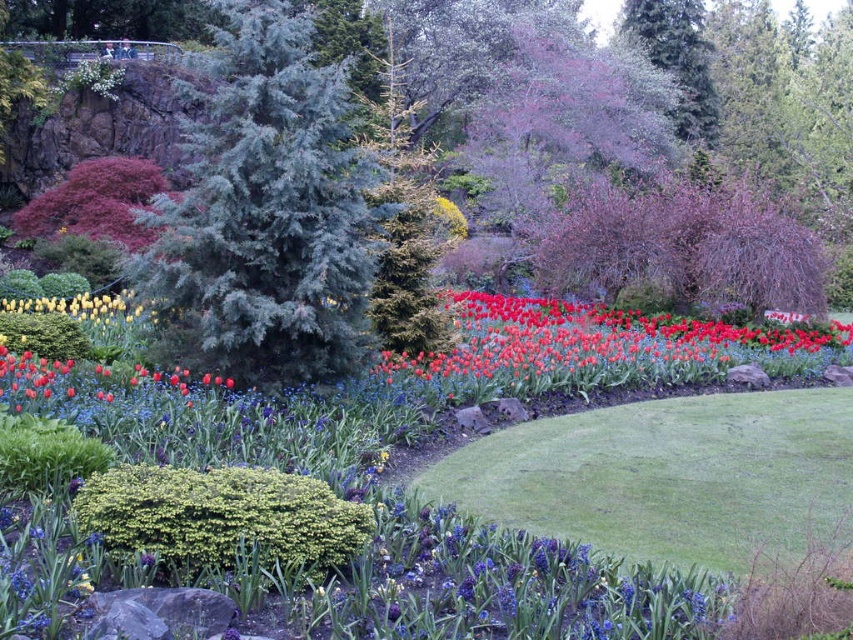
Can you confirm if green textured pine tree at center is wider than yellow matte tulip at left?

Correct, the width of green textured pine tree at center exceeds that of yellow matte tulip at left.

Which is behind, point (381, 321) or point (51, 305)?

The point (51, 305) is behind.

Locate an element on the screen. The width and height of the screenshot is (853, 640). green textured pine tree at center is located at coordinates (405, 216).

Is the position of green textured bush at lower center less distant than that of green textured pine tree at center?

Yes, it is in front of green textured pine tree at center.

Is green textured bush at lower center above green textured pine tree at center?

No, green textured bush at lower center is not above green textured pine tree at center.

Who is more forward, (125,509) or (392,58)?

Point (125,509)

This screenshot has height=640, width=853. I want to click on green textured bush at lower center, so click(222, 516).

Does bright red petals at center have a lesser width compared to yellow matte tulip at left?

No, bright red petals at center is not thinner than yellow matte tulip at left.

Is point (593, 376) positioned after point (105, 316)?

No, it is not.

Identify the location of bright red petals at center. Image resolution: width=853 pixels, height=640 pixels. (607, 344).